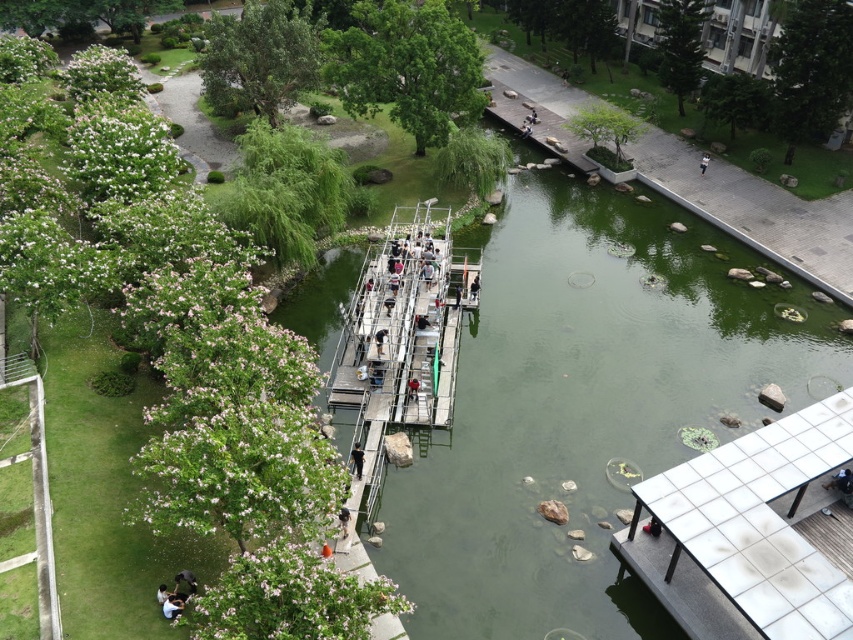
You are standing at the point labeled point [354,449] and want to reach the point labeled point [782,620]. Which direction should you move to get closer to your destination?

You should move forward because point [782,620] is in front of point [354,449].

You are a photographer standing on the wooden walkway in the park. You want to take a photo of the white tile dock at lower right and the dark brown leather jacket at lower center. Which object should you focus on first if you want to capture both in the same frame without adjusting your camera angle?

The white tile dock at lower right is taller than the dark brown leather jacket at lower center, so you should focus on the white tile dock at lower right first to ensure it fits within the frame.